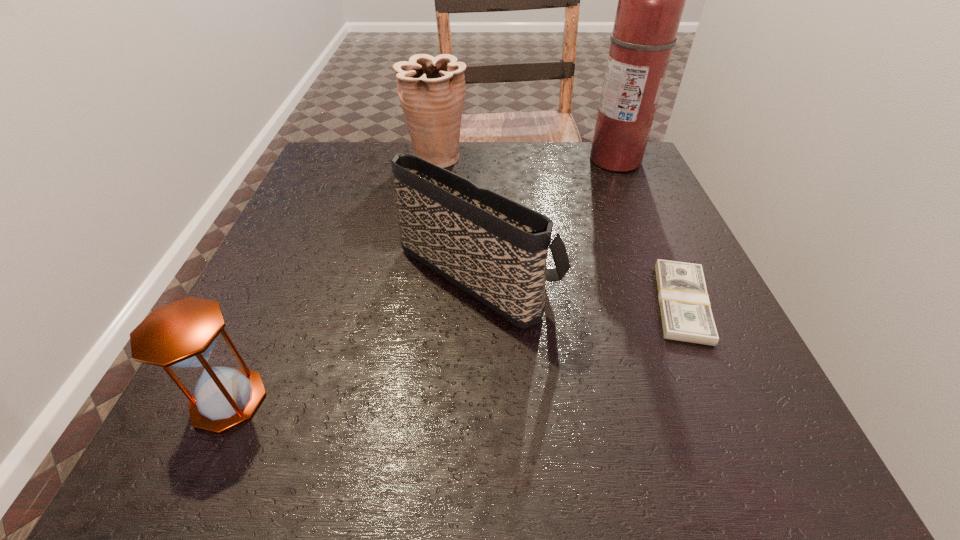
The image size is (960, 540). I want to click on free location located on the back of the third shortest object, so click(x=478, y=151).

Locate an element on the screen. The height and width of the screenshot is (540, 960). vacant region located 0.210m on the back of the fourth tallest object is located at coordinates (286, 274).

I want to click on free region located 0.170m on the back of the dollar, so click(x=641, y=213).

Where is `fire extinguisher positioned at the far edge`? This screenshot has width=960, height=540. fire extinguisher positioned at the far edge is located at coordinates (651, 0).

The height and width of the screenshot is (540, 960). Identify the location of urn located in the far edge section of the desktop. (431, 90).

Identify the location of object present at the near edge. Image resolution: width=960 pixels, height=540 pixels. (182, 334).

Where is `object at the left edge`? The height and width of the screenshot is (540, 960). object at the left edge is located at coordinates (182, 334).

You are a GUI agent. You are given a task and a screenshot of the screen. Output one action in this format:
    pyautogui.click(x=<x>, y=<y>)
    Task: Click on the fire extinguisher at the right edge
    The width and height of the screenshot is (960, 540).
    Given the screenshot: What is the action you would take?
    pyautogui.click(x=651, y=0)

I want to click on dollar located at the right edge, so click(686, 315).

I want to click on object that is at the near left corner, so click(182, 334).